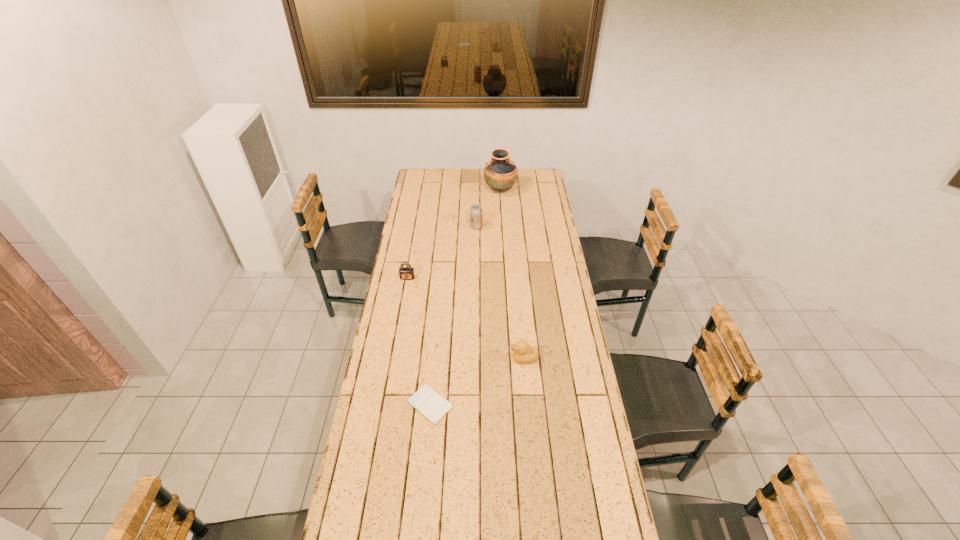
I want to click on vacant space in between the leftmost object and the second nearest object, so click(466, 318).

This screenshot has width=960, height=540. Identify the location of the closest object relative to the fourth nearest object. (500, 174).

Point out which object is positioned as the second nearest to the third nearest object. Please provide its 2D coordinates. Your answer should be formatted as a tuple, i.e. [(x, y)], where the tuple contains the x and y coordinates of a point satisfying the conditions above.

[(433, 406)]

Where is `vacant region that satisfies the following two spatial constraints: 1. on the back side of the third object from left to right; 2. on the right side of the fourth object from right to left`? vacant region that satisfies the following two spatial constraints: 1. on the back side of the third object from left to right; 2. on the right side of the fourth object from right to left is located at coordinates (446, 227).